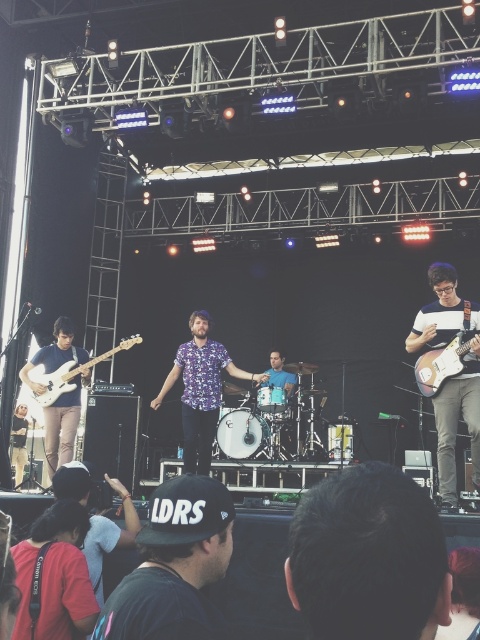
The height and width of the screenshot is (640, 480). I want to click on dark brown hair at center, so click(368, 557).

Where is `dark brown hair at center`? This screenshot has height=640, width=480. dark brown hair at center is located at coordinates (368, 557).

How much distance is there between wooden electric guitar at center and matte white electric guitar at left?

The distance of wooden electric guitar at center from matte white electric guitar at left is 2.95 meters.

Does wooden electric guitar at center have a larger size compared to matte white electric guitar at left?

Indeed, wooden electric guitar at center has a larger size compared to matte white electric guitar at left.

You are a GUI agent. You are given a task and a screenshot of the screen. Output one action in this format:
    pyautogui.click(x=<x>, y=<y>)
    Task: Click on the wooden electric guitar at center
    
    Given the screenshot: What is the action you would take?
    pyautogui.click(x=451, y=378)

Where is `wooden electric guitar at center`? Image resolution: width=480 pixels, height=640 pixels. wooden electric guitar at center is located at coordinates (451, 378).

Who is lower down, wooden electric guitar at center or floral shirt at center?

Positioned lower is floral shirt at center.

Can you confirm if wooden electric guitar at center is smaller than floral shirt at center?

Indeed, wooden electric guitar at center has a smaller size compared to floral shirt at center.

Between point (445, 428) and point (204, 465), which one is positioned in front?

Point (445, 428)

Locate an element on the screen. wooden electric guitar at center is located at coordinates (451, 378).